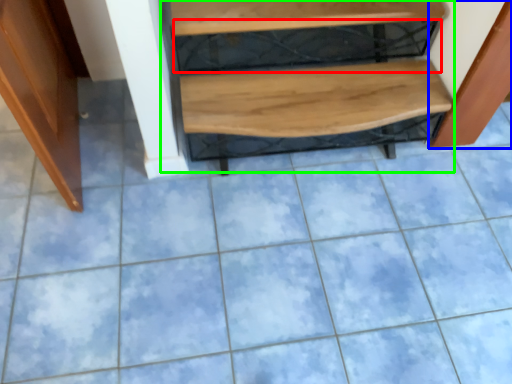
Question: Estimate the real-world distances between objects in this image. Which object is closer to shelf (highlighted by a red box), cabinetry (highlighted by a blue box) or stairwell (highlighted by a green box)?

Choices:
 (A) cabinetry
 (B) stairwell

Answer: (B)